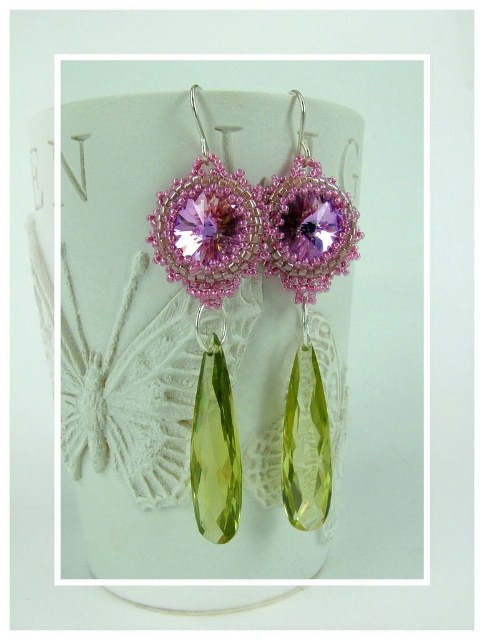
Looking at the earrings displayed against the white background, which object is located below the other between the pink beaded pearl at center and the matte pink glass bead at center?

The pink beaded pearl at center is positioned below the matte pink glass bead at center.

You are an appraiser examining two earrings. The first earring has a pink beaded pearl at center, and the second has a matte pink glass bead at center. Which one is taller?

The pink beaded pearl at center has a greater height compared to the matte pink glass bead at center, so the pink beaded pearl at center is taller.